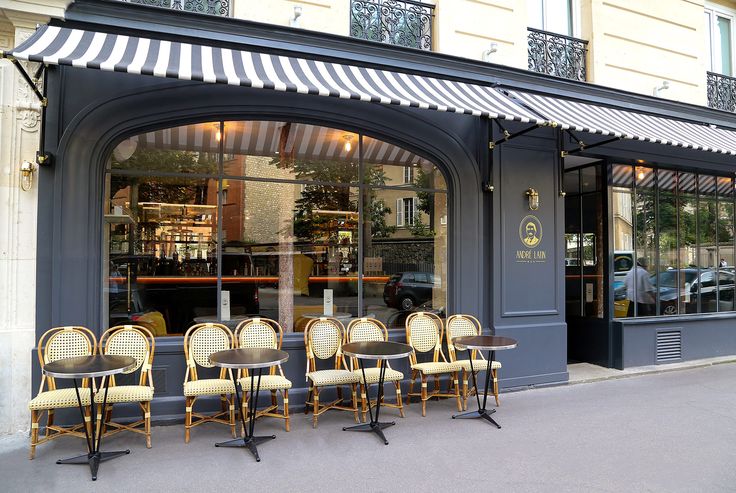
Find the location of a particular element. back part chair is located at coordinates (68, 346), (130, 347), (207, 340), (255, 341), (325, 336), (374, 332), (461, 327), (431, 332).